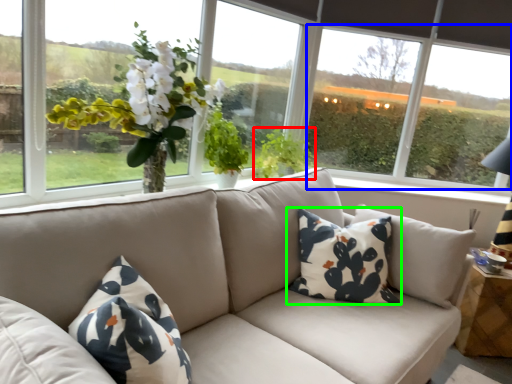
Question: Which object is positioned closest to plant (highlighted by a red box)? Select from window screen (highlighted by a blue box) and pillow (highlighted by a green box).

Choices:
 (A) window screen
 (B) pillow

Answer: (B)